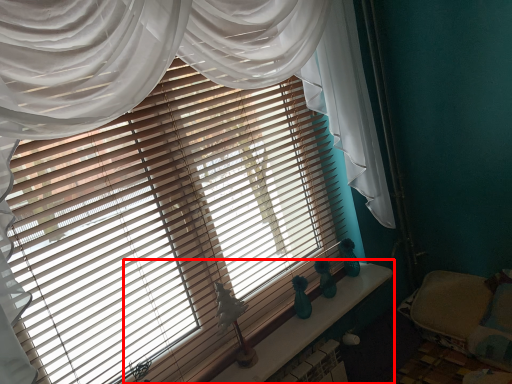
Question: From the image's perspective, where is window sill (annotated by the red box) located relative to bed?

Choices:
 (A) below
 (B) above

Answer: (A)